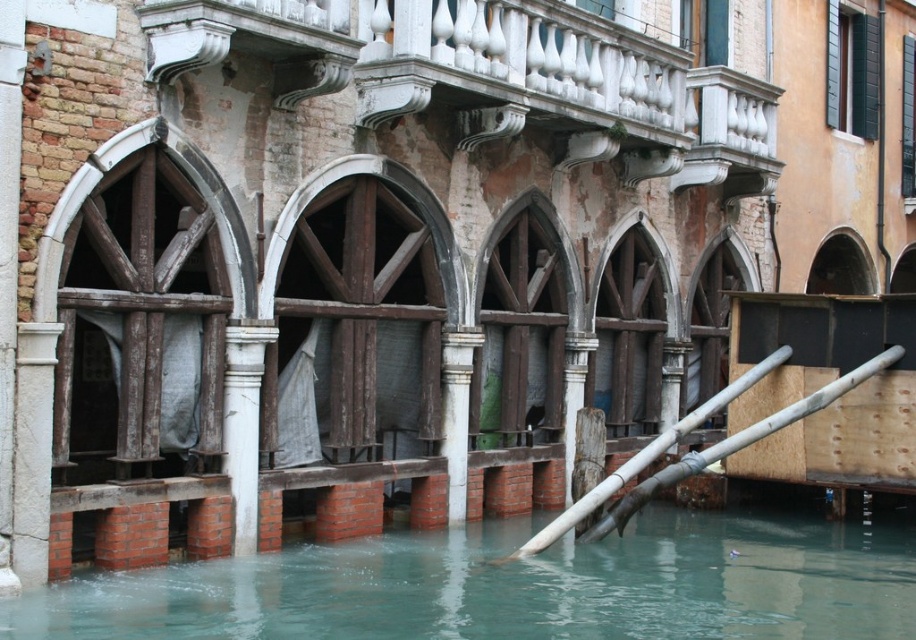
Based on the photo, is the position of clear water at lower center less distant than that of white marble balcony at upper center?

Yes, it is in front of white marble balcony at upper center.

Is clear water at lower center taller than white marble balcony at upper center?

In fact, clear water at lower center may be shorter than white marble balcony at upper center.

What do you see at coordinates (513, 588) in the screenshot? The width and height of the screenshot is (916, 640). I see `clear water at lower center` at bounding box center [513, 588].

You are a GUI agent. You are given a task and a screenshot of the screen. Output one action in this format:
    pyautogui.click(x=<x>, y=<y>)
    Task: Click on the clear water at lower center
    This screenshot has height=640, width=916.
    Given the screenshot: What is the action you would take?
    pyautogui.click(x=513, y=588)

Can you confirm if white marble balcony at upper center is taller than smooth bamboo pole at lower right?

No, white marble balcony at upper center is not taller than smooth bamboo pole at lower right.

Does point (235, 13) come behind point (874, 356)?

No, it is in front of (874, 356).

Locate an element on the screen. This screenshot has width=916, height=640. white marble balcony at upper center is located at coordinates pos(498,74).

Which of these two, white marble balcony at upper center or wooden/wooden-textured archway at center, stands shorter?

With less height is white marble balcony at upper center.

Does point (715, 77) lie behind point (602, 333)?

Yes, it is behind point (602, 333).

The height and width of the screenshot is (640, 916). Find the location of `white marble balcony at upper center`. white marble balcony at upper center is located at coordinates (498, 74).